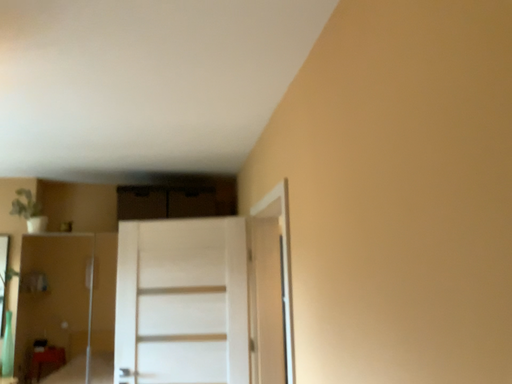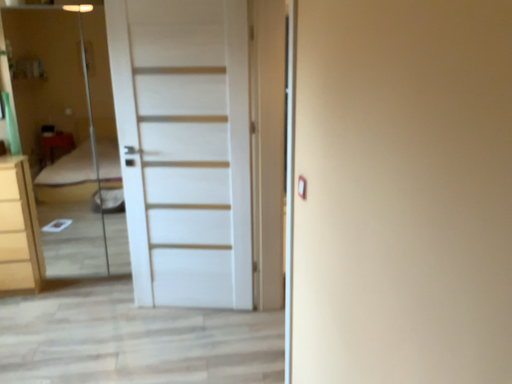
Question: How did the camera likely rotate when shooting the video?

Choices:
 (A) rotated downward
 (B) rotated upward

Answer: (A)